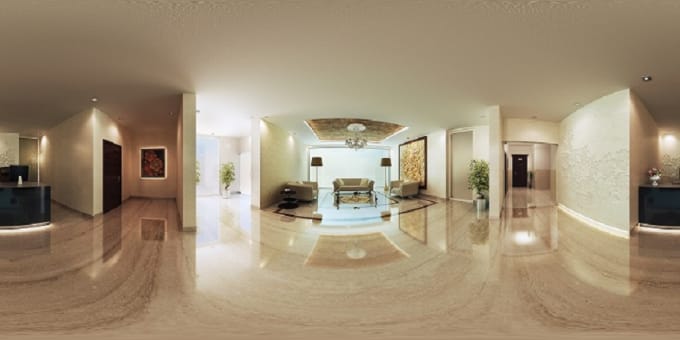
Identify the location of floor. (343, 298).